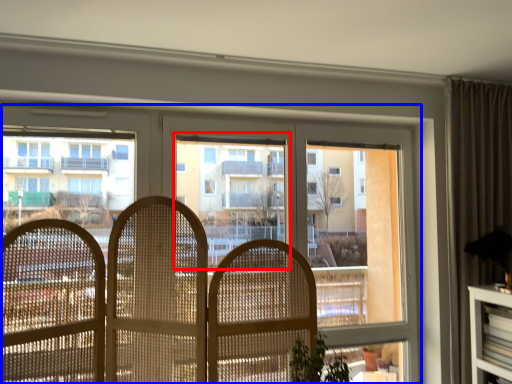
Question: Which point is further to the camera, bay window (highlighted by a red box) or window (highlighted by a blue box)?

Choices:
 (A) bay window
 (B) window

Answer: (A)